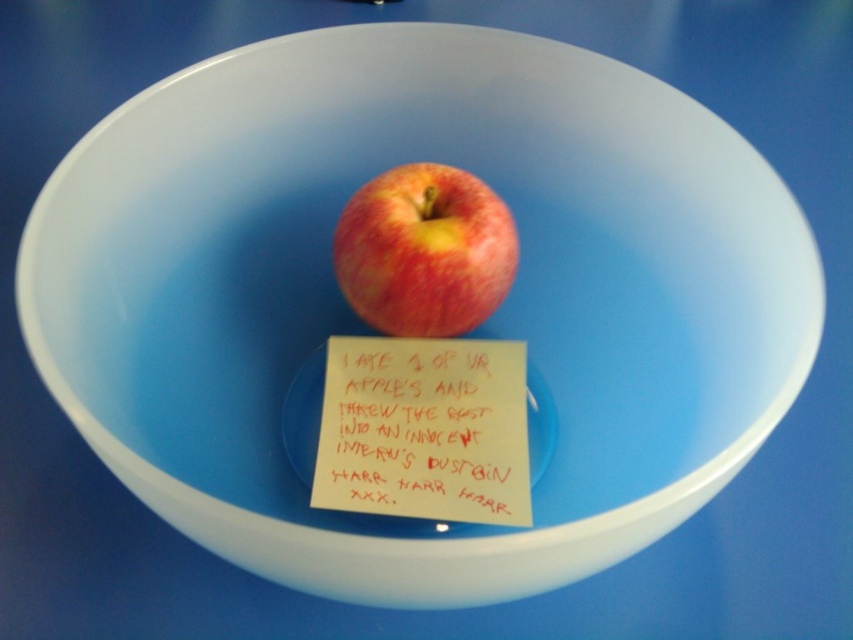
Question: Among these objects, which one is farthest from the camera?

Choices:
 (A) shiny red apple at center
 (B) white paper at center

Answer: (A)

Question: Is white paper at center in front of shiny red apple at center?

Choices:
 (A) no
 (B) yes

Answer: (B)

Question: Among these points, which one is farthest from the camera?

Choices:
 (A) (389, 188)
 (B) (440, 422)

Answer: (A)

Question: Among these points, which one is farthest from the camera?

Choices:
 (A) (350, 468)
 (B) (335, 248)

Answer: (B)

Question: Does white paper at center have a lesser width compared to shiny red apple at center?

Choices:
 (A) no
 (B) yes

Answer: (A)

Question: Is white paper at center further to the viewer compared to shiny red apple at center?

Choices:
 (A) yes
 (B) no

Answer: (B)